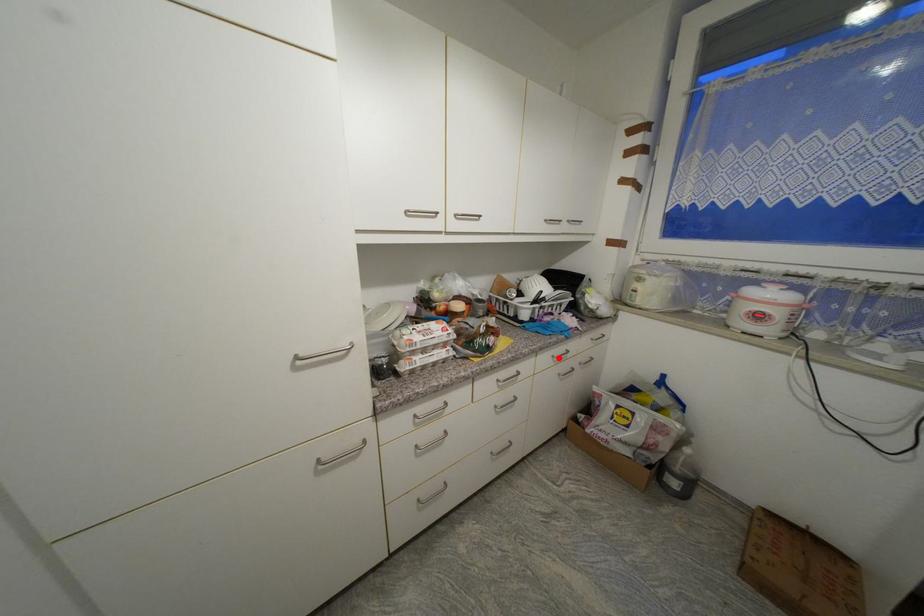
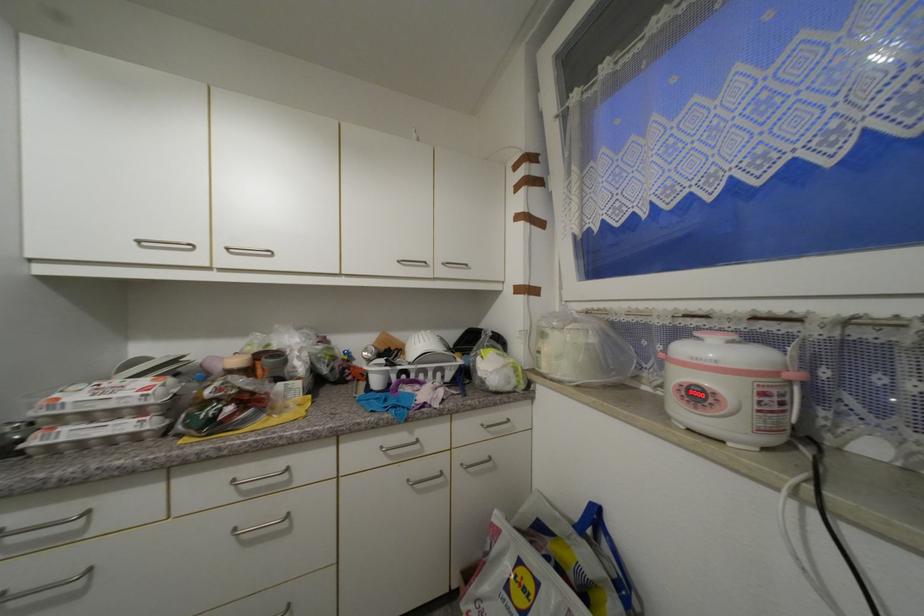
Find the pixel in the second image that matches the highlighted location in the first image.

(387, 448)